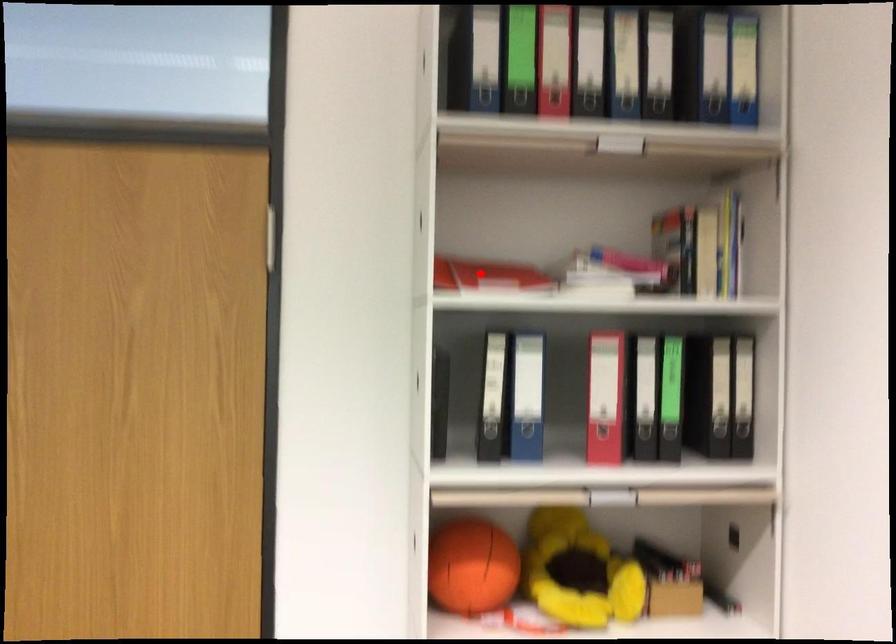
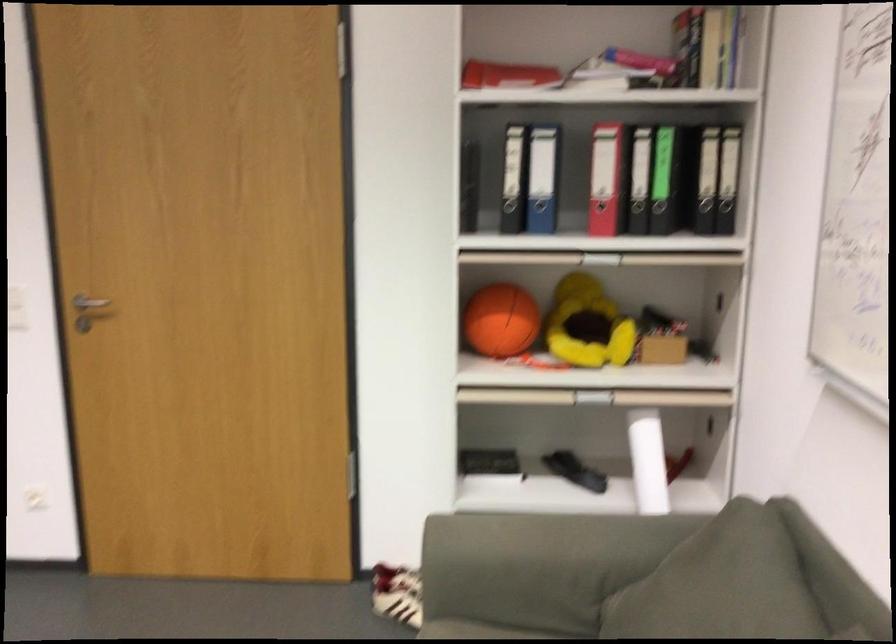
In the second image, find the point that corresponds to the highlighted location in the first image.

(506, 75)